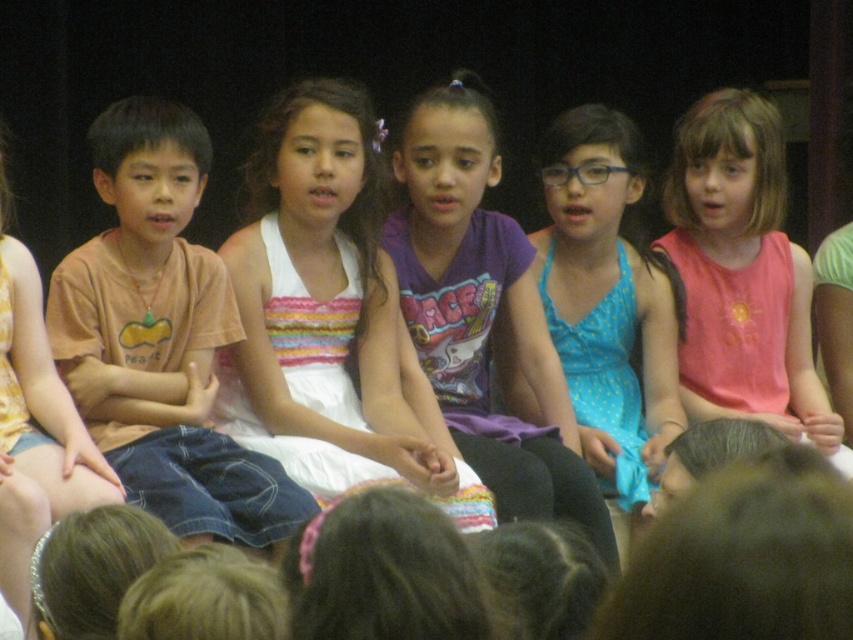
Question: Which of the following is the farthest from the observer?

Choices:
 (A) (308, 152)
 (B) (281, 492)

Answer: (A)

Question: Does white satin dress at center appear on the right side of brown cotton shirt at left?

Choices:
 (A) no
 (B) yes

Answer: (B)

Question: Does white satin dress at center appear on the right side of brown cotton shirt at left?

Choices:
 (A) yes
 (B) no

Answer: (A)

Question: Which object is closer to the camera taking this photo?

Choices:
 (A) white satin dress at center
 (B) brown cotton shirt at left

Answer: (B)

Question: Does white satin dress at center come in front of brown cotton shirt at left?

Choices:
 (A) no
 (B) yes

Answer: (A)